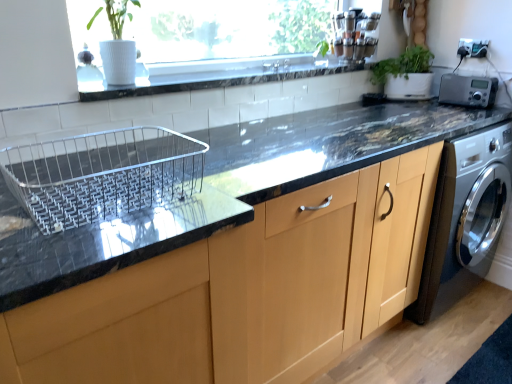
Question: Would you say silver metallic radio at upper right is a long distance from green matte plant at upper right?

Choices:
 (A) yes
 (B) no

Answer: (B)

Question: From a real-world perspective, does silver metallic radio at upper right stand above green matte plant at upper right?

Choices:
 (A) no
 (B) yes

Answer: (A)

Question: Is silver metallic radio at upper right in contact with green matte plant at upper right?

Choices:
 (A) yes
 (B) no

Answer: (B)

Question: Is silver metallic radio at upper right at the left side of green matte plant at upper right?

Choices:
 (A) yes
 (B) no

Answer: (B)

Question: Is silver metallic radio at upper right wider than green matte plant at upper right?

Choices:
 (A) no
 (B) yes

Answer: (A)

Question: Considering the positions of green matte plant at upper right and white tile at upper center in the image, is green matte plant at upper right taller or shorter than white tile at upper center?

Choices:
 (A) short
 (B) tall

Answer: (B)

Question: Looking at their shapes, would you say green matte plant at upper right is wider or thinner than white tile at upper center?

Choices:
 (A) wide
 (B) thin

Answer: (B)

Question: Would you say green matte plant at upper right is inside or outside white tile at upper center?

Choices:
 (A) inside
 (B) outside

Answer: (B)

Question: From a real-world perspective, relative to white tile at upper center, is green matte plant at upper right vertically above or below?

Choices:
 (A) below
 (B) above

Answer: (A)

Question: Is white tile at upper center bigger or smaller than green matte plant at upper right?

Choices:
 (A) small
 (B) big

Answer: (A)

Question: From the image's perspective, is white tile at upper center positioned above or below green matte plant at upper right?

Choices:
 (A) below
 (B) above

Answer: (A)

Question: Is white tile at upper center taller or shorter than green matte plant at upper right?

Choices:
 (A) short
 (B) tall

Answer: (A)

Question: Would you say white tile at upper center is to the left or to the right of green matte plant at upper right in the picture?

Choices:
 (A) right
 (B) left

Answer: (B)

Question: Do you think white tile at upper center is within silver metallic radio at upper right, or outside of it?

Choices:
 (A) inside
 (B) outside

Answer: (B)

Question: From a real-world perspective, is white tile at upper center physically located above or below silver metallic radio at upper right?

Choices:
 (A) below
 (B) above

Answer: (B)